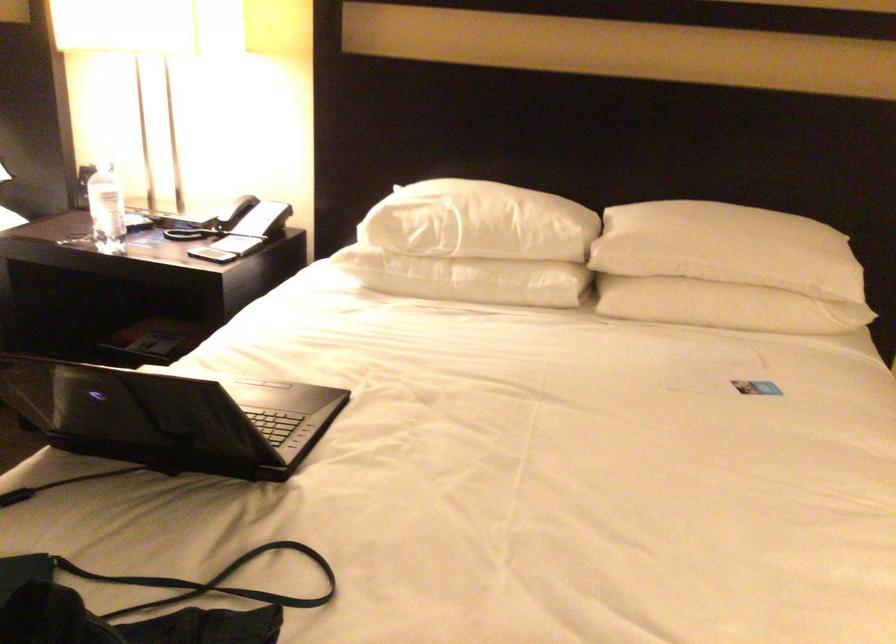
Where would you lift the black laptop? Please return your answer as a coordinate pair (x, y).

(170, 415)